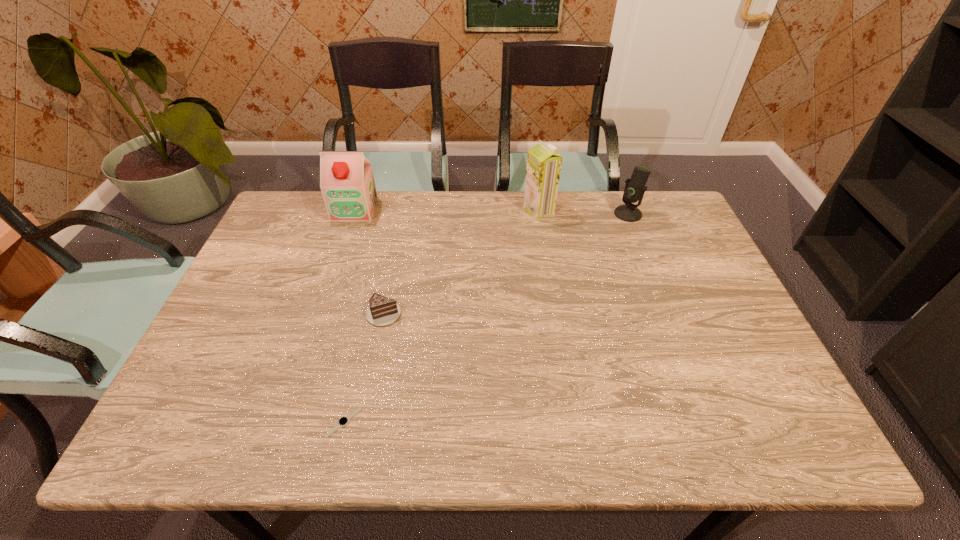
This screenshot has height=540, width=960. I want to click on free point at the right edge, so click(x=713, y=325).

The width and height of the screenshot is (960, 540). In order to click on vacant region at the near right corner of the desktop in this screenshot , I will do `click(797, 448)`.

I want to click on free area in between the rightmost object and the fourth object from left to right, so click(584, 212).

Identify the location of free area in between the right soya milk and the fourth farthest object. (462, 261).

The image size is (960, 540). I want to click on empty space that is in between the right soya milk and the chocolate cake, so click(462, 261).

This screenshot has height=540, width=960. What are the coordinates of `vacant area between the rightmost object and the chocolate cake` in the screenshot? It's located at (506, 263).

Image resolution: width=960 pixels, height=540 pixels. I want to click on vacant area that lies between the rightmost object and the leftmost object, so click(x=492, y=212).

Where is `vacant space in between the left soya milk and the third tallest object`? This screenshot has width=960, height=540. vacant space in between the left soya milk and the third tallest object is located at coordinates (492, 212).

The image size is (960, 540). I want to click on vacant space that is in between the right soya milk and the second nearest object, so click(462, 261).

The image size is (960, 540). In order to click on free space between the shortest object and the fourth farthest object in this screenshot , I will do point(364,367).